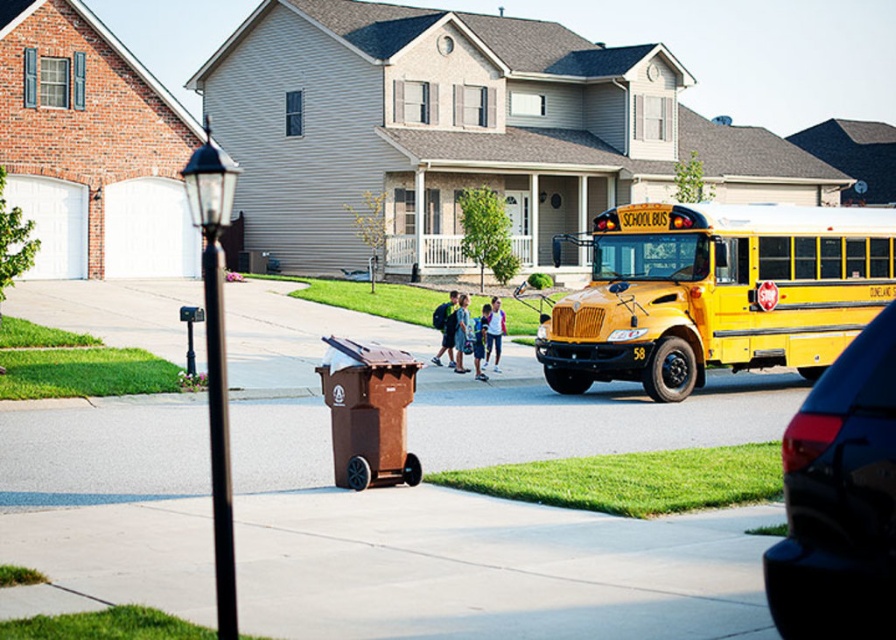
Does point (823, 356) come in front of point (854, 616)?

No, it is not.

Is point (636, 244) positioned after point (879, 392)?

Yes.

Who is more distant from viewer, (892, 240) or (851, 545)?

The point (892, 240) is more distant.

Locate an element on the screen. yellow matte/solid school bus at right is located at coordinates (716, 292).